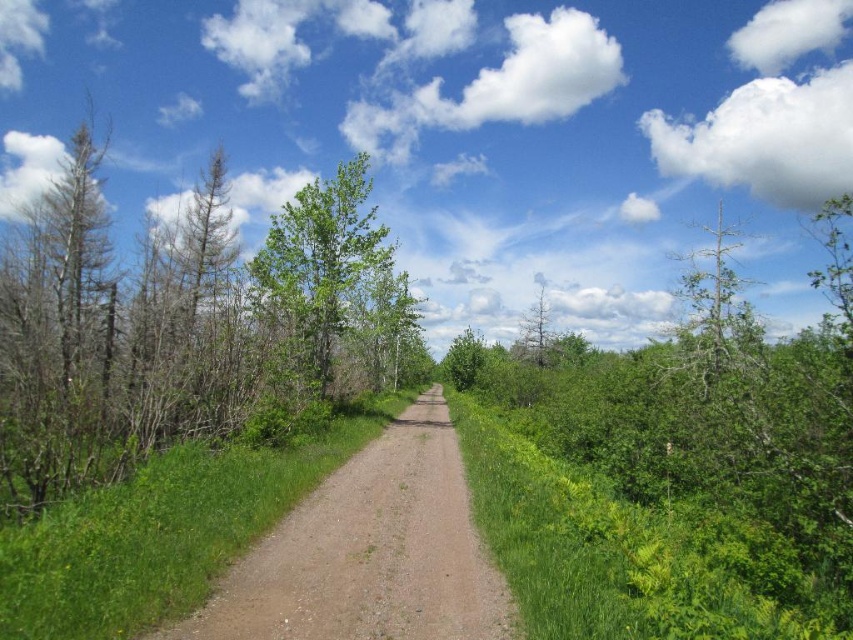
Which is behind, point (271, 262) or point (375, 358)?

The point (375, 358) is more distant.

Can you confirm if green leafy tree at left is positioned above green leafy tree at center?

Correct, green leafy tree at left is located above green leafy tree at center.

Where is `green leafy tree at left`? This screenshot has width=853, height=640. green leafy tree at left is located at coordinates (184, 324).

Measure the distance from dirt/gravel path at center to green leafy tree at center.

dirt/gravel path at center and green leafy tree at center are 370.58 feet apart from each other.

Where is `dirt/gravel path at center`? This screenshot has height=640, width=853. dirt/gravel path at center is located at coordinates (369, 552).

The height and width of the screenshot is (640, 853). Describe the element at coordinates (369, 552) in the screenshot. I see `dirt/gravel path at center` at that location.

The image size is (853, 640). Identify the location of dirt/gravel path at center. (369, 552).

Which is behind, point (79, 317) or point (345, 506)?

The point (79, 317) is behind.

Describe the element at coordinates (184, 324) in the screenshot. I see `green leafy tree at left` at that location.

The height and width of the screenshot is (640, 853). I want to click on green leafy tree at left, so click(184, 324).